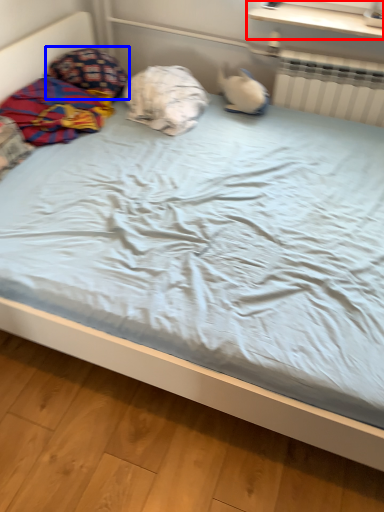
Question: Which object is closer to the camera taking this photo, window sill (highlighted by a red box) or pillow (highlighted by a blue box)?

Choices:
 (A) window sill
 (B) pillow

Answer: (A)